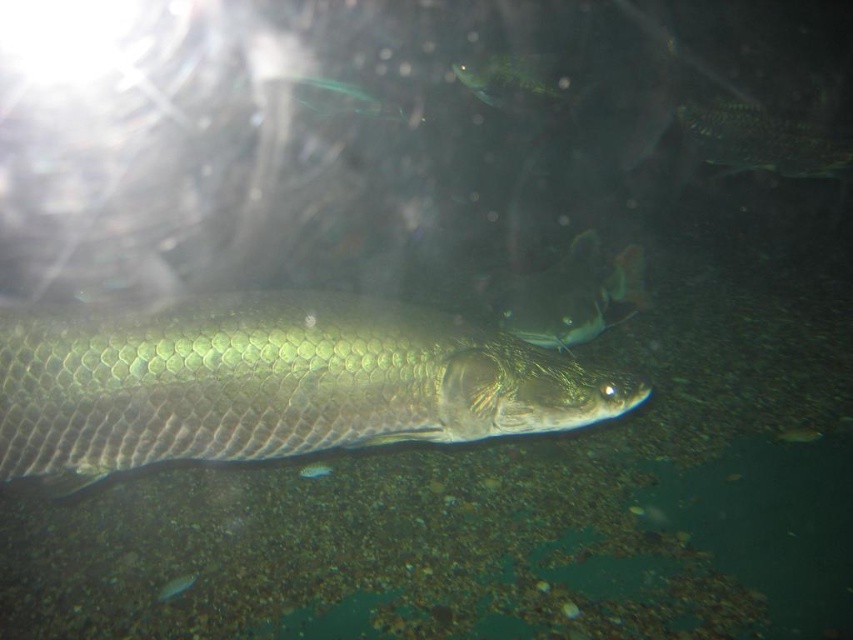
Who is taller, green scaly fish at center or shiny silver fish at lower left?

green scaly fish at center

Does green scaly fish at center have a lesser width compared to shiny silver fish at lower left?

In fact, green scaly fish at center might be wider than shiny silver fish at lower left.

Identify the location of green scaly fish at center. The image size is (853, 640). (271, 381).

Can you confirm if green scaly fish at center is positioned below green shiny fish at upper center?

Yes.

Who is higher up, green scaly fish at center or green shiny fish at upper center?

green shiny fish at upper center

Describe the element at coordinates (271, 381) in the screenshot. The width and height of the screenshot is (853, 640). I see `green scaly fish at center` at that location.

What are the coordinates of `green scaly fish at center` in the screenshot? It's located at (271, 381).

Does shiny silver fish at center come behind green shiny fish at upper center?

No, it is in front of green shiny fish at upper center.

Who is positioned more to the left, shiny silver fish at center or green shiny fish at upper center?

green shiny fish at upper center

Locate an element on the screen. The image size is (853, 640). shiny silver fish at center is located at coordinates (567, 296).

Locate an element on the screen. shiny silver fish at center is located at coordinates (567, 296).